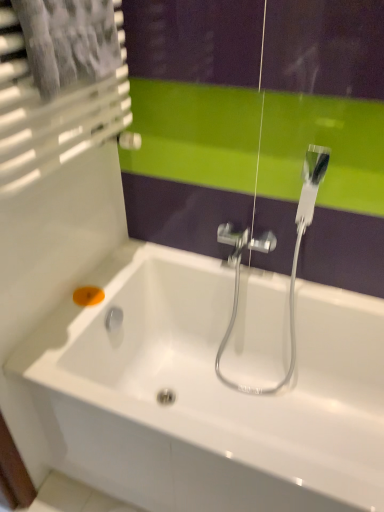
Question: From a real-world perspective, is white glossy bathtub at center below orange matte soap at lower left?

Choices:
 (A) no
 (B) yes

Answer: (B)

Question: Can orange matte soap at lower left be found inside white glossy bathtub at center?

Choices:
 (A) no
 (B) yes

Answer: (B)

Question: Is white glossy bathtub at center not within orange matte soap at lower left?

Choices:
 (A) yes
 (B) no

Answer: (A)

Question: From a real-world perspective, is white glossy bathtub at center located higher than orange matte soap at lower left?

Choices:
 (A) no
 (B) yes

Answer: (A)

Question: Is white glossy bathtub at center behind orange matte soap at lower left?

Choices:
 (A) yes
 (B) no

Answer: (B)

Question: Considering the relative sizes of white glossy bathtub at center and orange matte soap at lower left in the image provided, is white glossy bathtub at center smaller than orange matte soap at lower left?

Choices:
 (A) yes
 (B) no

Answer: (B)

Question: Is orange matte soap at lower left in contact with white glossy bathtub at center?

Choices:
 (A) yes
 (B) no

Answer: (B)

Question: Considering the relative positions of orange matte soap at lower left and white glossy bathtub at center in the image provided, is orange matte soap at lower left to the right of white glossy bathtub at center from the viewer's perspective?

Choices:
 (A) no
 (B) yes

Answer: (A)

Question: Is orange matte soap at lower left thinner than white glossy bathtub at center?

Choices:
 (A) no
 (B) yes

Answer: (B)

Question: Is orange matte soap at lower left taller than white glossy bathtub at center?

Choices:
 (A) yes
 (B) no

Answer: (B)

Question: Is orange matte soap at lower left positioned before white glossy bathtub at center?

Choices:
 (A) yes
 (B) no

Answer: (B)

Question: Does orange matte soap at lower left have a larger size compared to white glossy bathtub at center?

Choices:
 (A) yes
 (B) no

Answer: (B)

Question: Is white glossy bathtub at center spatially inside orange matte soap at lower left, or outside of it?

Choices:
 (A) inside
 (B) outside

Answer: (B)